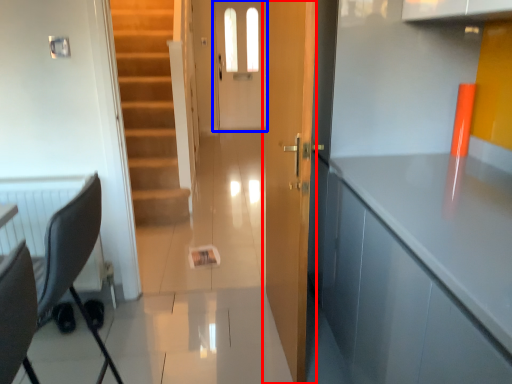
Question: Which object appears farthest to the camera in this image, door (highlighted by a red box) or screen door (highlighted by a blue box)?

Choices:
 (A) door
 (B) screen door

Answer: (B)